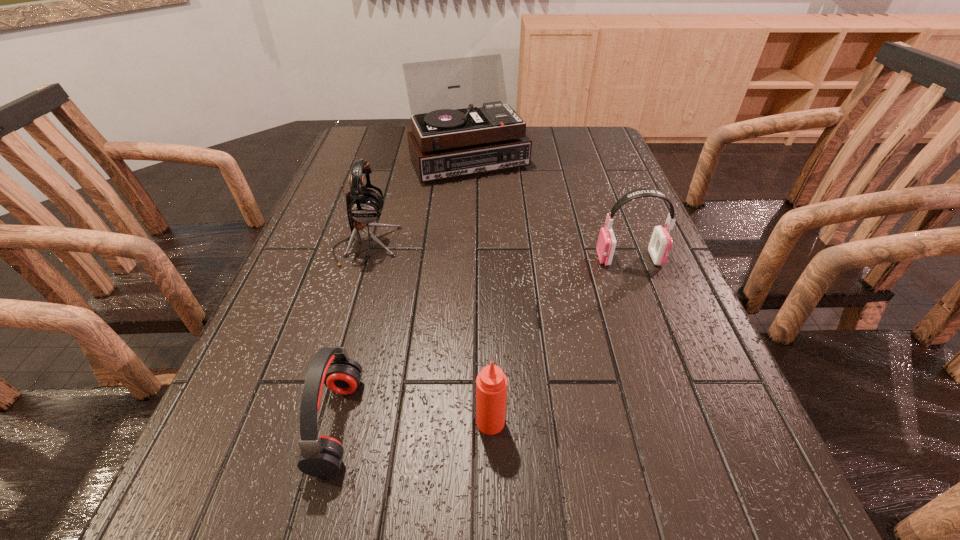
At what (x,y) coordinates should I click in order to perform the action: click on the farthest object. Please return your answer as a coordinate pair (x, y). This screenshot has height=540, width=960. Looking at the image, I should click on (452, 135).

At what (x,y) coordinates should I click in order to perform the action: click on the tallest object. Please return your answer as a coordinate pair (x, y). Image resolution: width=960 pixels, height=540 pixels. Looking at the image, I should click on (452, 135).

The image size is (960, 540). I want to click on the rightmost object, so click(x=660, y=244).

Locate an element on the screen. the rightmost earphone is located at coordinates (660, 244).

Locate an element on the screen. Tabasco sauce is located at coordinates (491, 383).

I want to click on the shortest earphone, so click(x=321, y=456).

Identify the location of vacant space located 0.390m on the front of the record player. The width and height of the screenshot is (960, 540). (464, 281).

In order to click on vacant area situated 0.340m on the outer surface of the rightmost object in this screenshot , I will do `click(450, 259)`.

You are a GUI agent. You are given a task and a screenshot of the screen. Output one action in this format:
    pyautogui.click(x=<x>, y=<y>)
    Task: Click on the free space located on the outer surface of the rightmost object
    The height and width of the screenshot is (540, 960).
    Given the screenshot: What is the action you would take?
    pyautogui.click(x=459, y=259)

Locate an element on the screen. vacant space located 0.110m on the outer surface of the rightmost object is located at coordinates (550, 259).